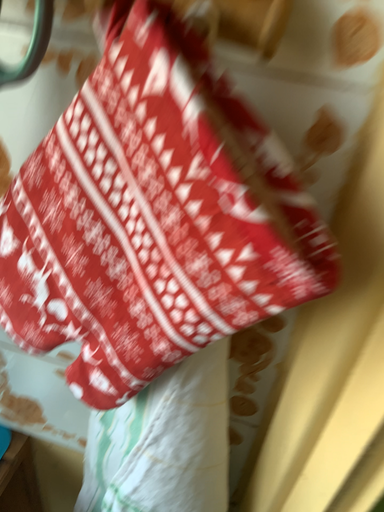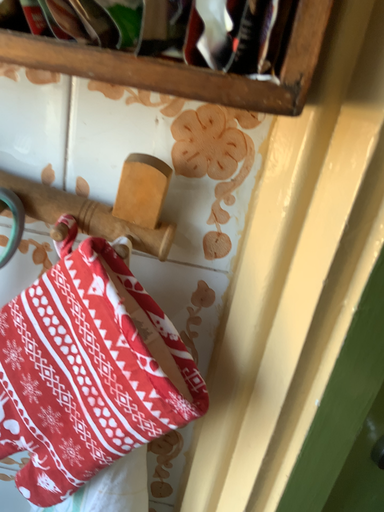
Question: Which way did the camera rotate in the video?

Choices:
 (A) rotated right
 (B) rotated left

Answer: (A)